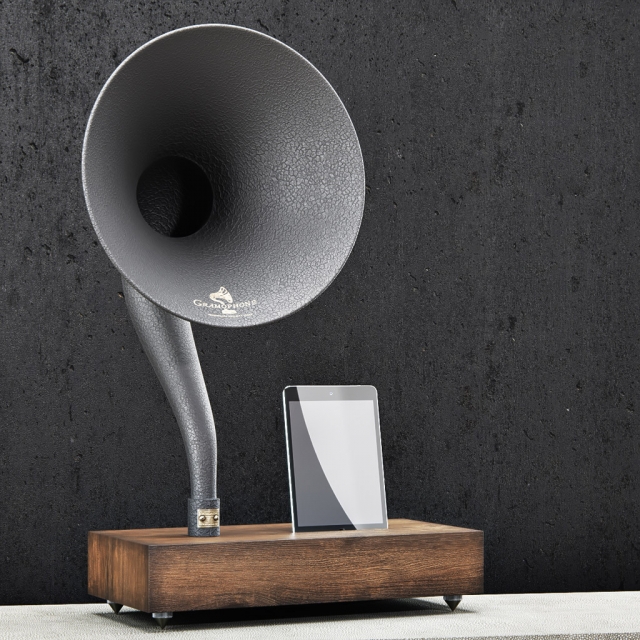
Identify the location of white spot on wall. (397, 157).